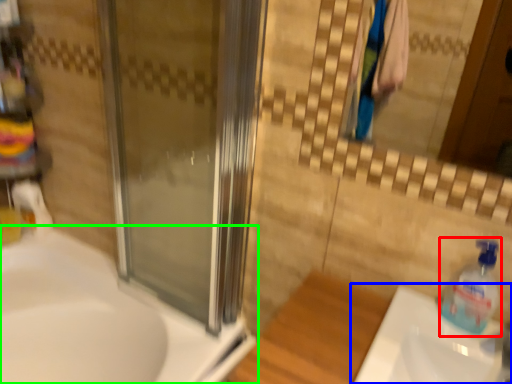
Question: Based on their relative distances, which object is nearer to cleaning product (highlighted by a red box)? Choose from sink (highlighted by a blue box) and sink (highlighted by a green box).

Choices:
 (A) sink
 (B) sink

Answer: (A)